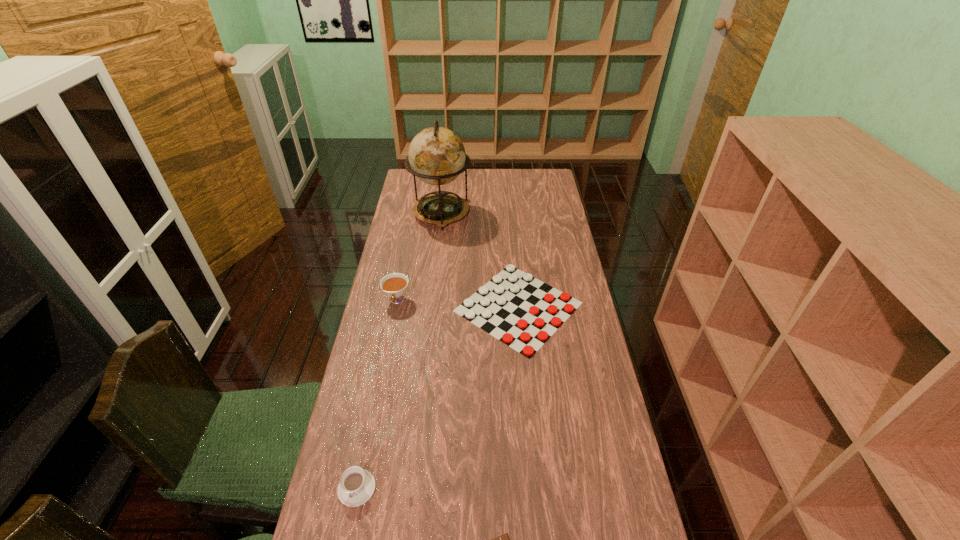
Identify the location of the farthest object. Image resolution: width=960 pixels, height=540 pixels. (437, 156).

You are a GUI agent. You are given a task and a screenshot of the screen. Output one action in this format:
    pyautogui.click(x=<x>, y=<y>)
    Task: Click on the tallest object
    
    Given the screenshot: What is the action you would take?
    click(x=437, y=156)

This screenshot has width=960, height=540. I want to click on the farther teacup, so click(x=394, y=285).

The width and height of the screenshot is (960, 540). In order to click on the fourth shortest object in this screenshot , I will do `click(394, 285)`.

The image size is (960, 540). Identify the location of the shorter teacup. (357, 485).

Image resolution: width=960 pixels, height=540 pixels. In order to click on the fourth farthest object in this screenshot , I will do `click(357, 485)`.

Locate an element on the screen. Image resolution: width=960 pixels, height=540 pixels. checkerboard is located at coordinates click(x=525, y=326).

Locate an element on the screen. This screenshot has height=540, width=960. vacant space located at the center of the globe is located at coordinates (432, 294).

At what (x,y) coordinates should I click in order to perform the action: click on blank space located on the side of the fourth shortest object with the handle. Please return your answer as a coordinate pair (x, y). The height and width of the screenshot is (540, 960). Looking at the image, I should click on tap(380, 388).

At what (x,y) coordinates should I click in order to perform the action: click on vacant space located on the back of the fourth tallest object. Please return your answer as a coordinate pair (x, y). Looking at the image, I should click on (512, 228).